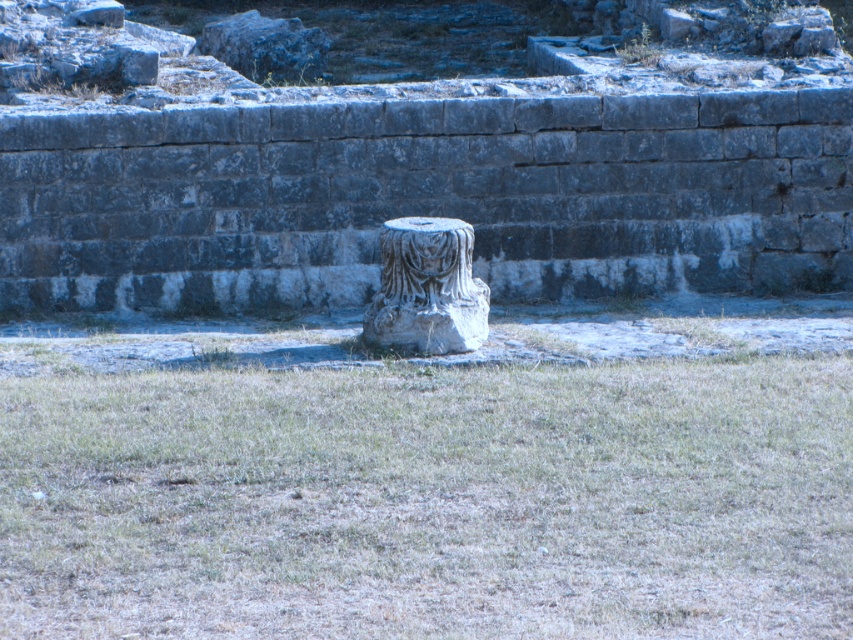
Between point (677, 396) and point (410, 316), which one is positioned in front?

Point (677, 396) is more forward.

This screenshot has width=853, height=640. What are the coordinates of `green grass at center` in the screenshot? It's located at (422, 496).